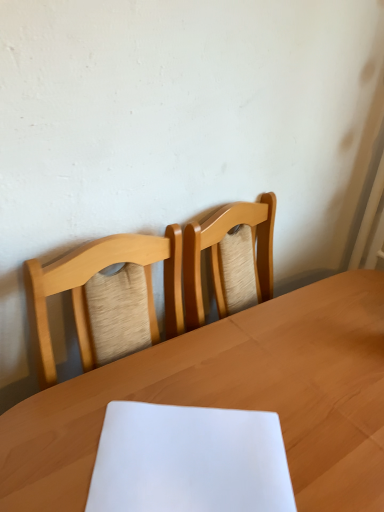
Where is `empty space that is ontop of white paper at center (from a real-world perspective)`? The width and height of the screenshot is (384, 512). empty space that is ontop of white paper at center (from a real-world perspective) is located at coordinates (182, 447).